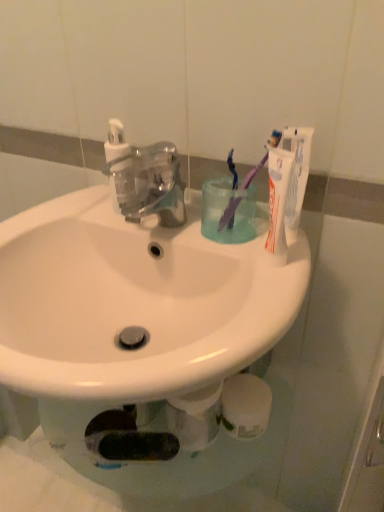
This screenshot has width=384, height=512. Identify the location of vacant area that is in front of white matte toothpaste at upper right. (274, 288).